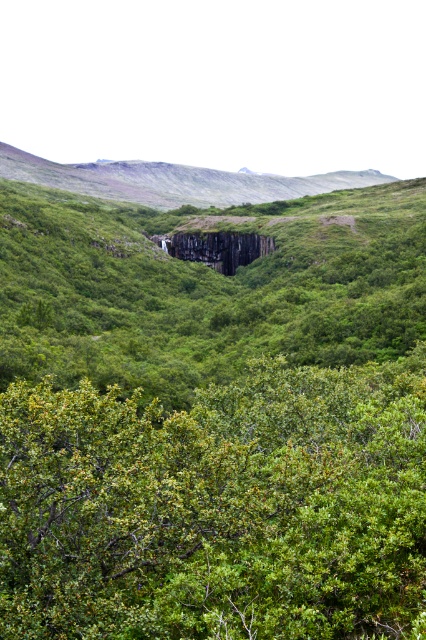
How much distance is there between green leafy bush at center and black granite rock at center?

green leafy bush at center is 256.58 meters away from black granite rock at center.

Does green leafy bush at center have a lesser height compared to black granite rock at center?

Yes, green leafy bush at center is shorter than black granite rock at center.

Where is `green leafy bush at center`? This screenshot has height=640, width=426. green leafy bush at center is located at coordinates (218, 508).